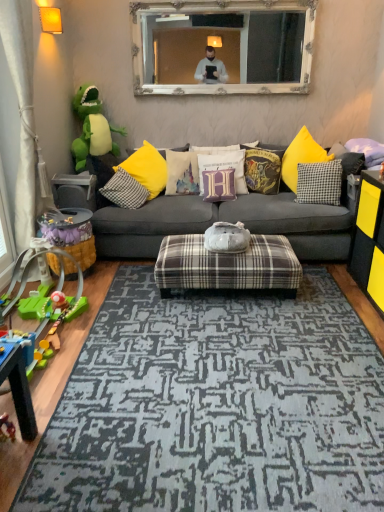
The width and height of the screenshot is (384, 512). Identify the location of blank space above blue-gray textured rug at center (from a real-world perspective). (248, 379).